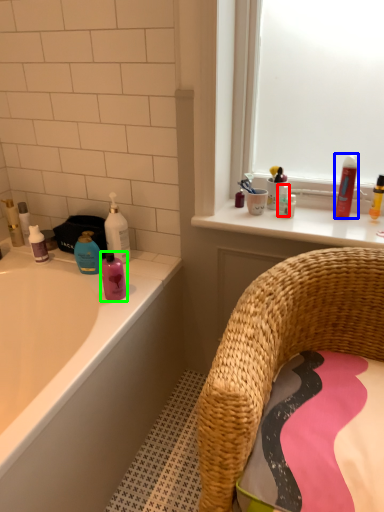
Question: Based on their relative distances, which object is farther from toiletry (highlighted by a red box)? Choose from mouthwash (highlighted by a blue box) and mouthwash (highlighted by a green box).

Choices:
 (A) mouthwash
 (B) mouthwash

Answer: (B)